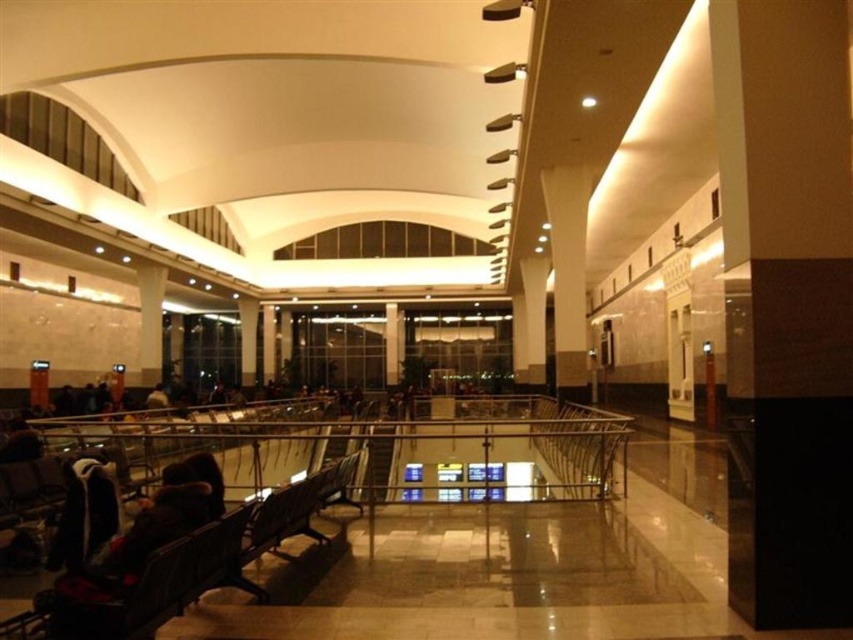
You are standing at the entrance of the airport terminal and see two points marked on the floor. The first point is labeled as point (805, 561) and the second point is labeled as point (556, 204). Which point is closer to you as you face the entrance?

Point (805, 561) is in front of point (556, 204), so it is closer to you as you face the entrance.

Based on the photo, you are a traveler carrying a dark brown leather jacket at center and need to reach the black polished stone pillar at right to check your flight information. Which direction should you move to get there from your current position?

The black polished stone pillar at right is positioned on the right side of the dark brown leather jacket at center, so you should move to your right to reach it.

You are standing at the entrance of the building and see the point marked at coordinates (567, 273). What object is located at that point?

The point at coordinates (567, 273) marks the location of the white glossy pillar at center.